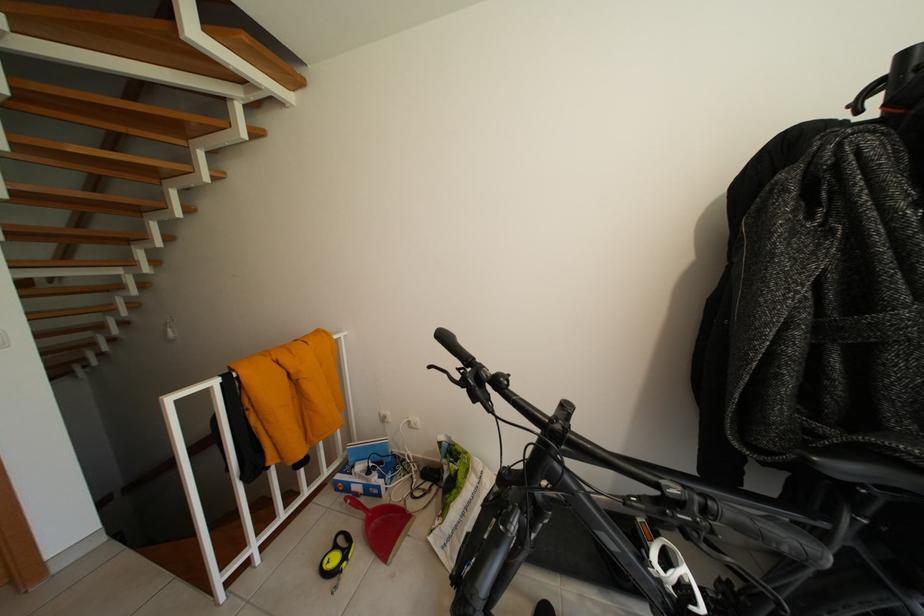
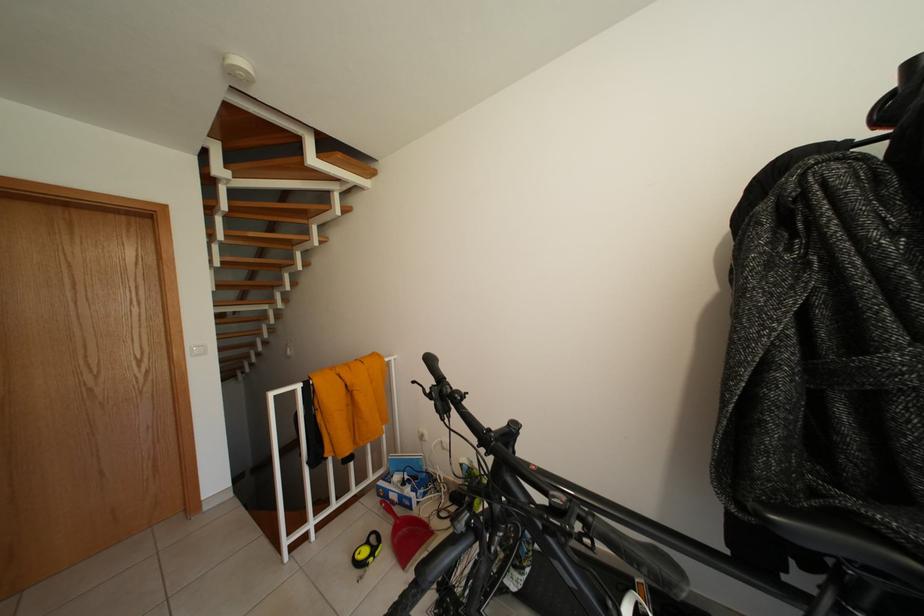
Which direction would the cameraman need to move to produce the second image?

The movement direction of the cameraman is right, backward.